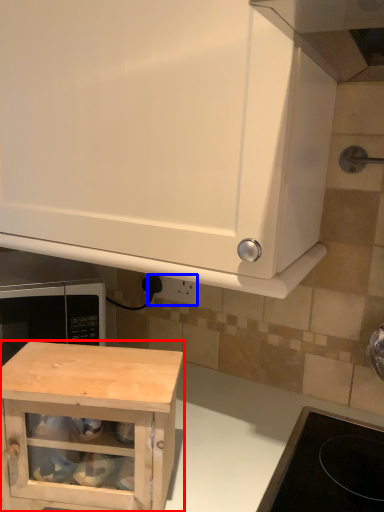
Question: Among these objects, which one is farthest to the camera, cabinetry (highlighted by a red box) or electric outlet (highlighted by a blue box)?

Choices:
 (A) cabinetry
 (B) electric outlet

Answer: (B)